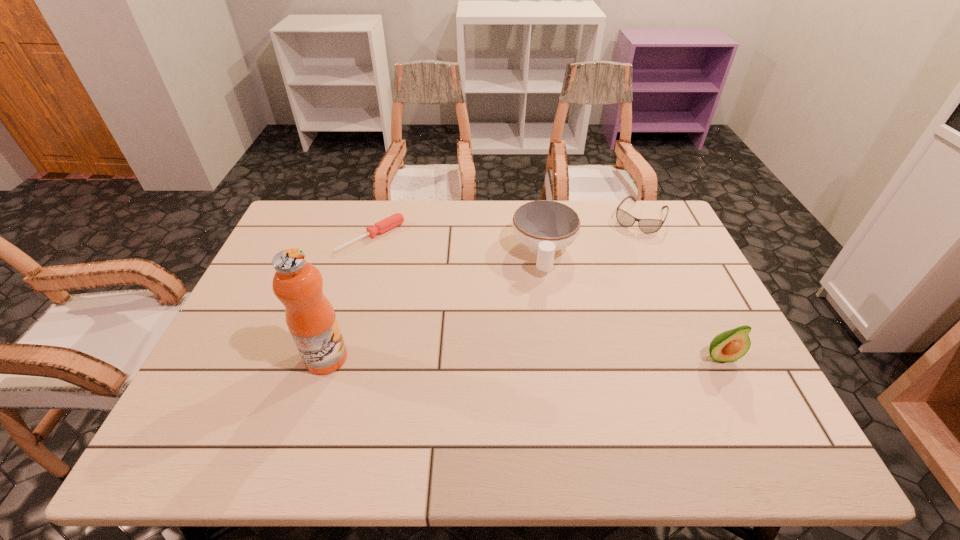
I want to click on free space that satisfies the following two spatial constraints: 1. on the back side of the third tallest object; 2. on the right side of the tallest object, so click(x=359, y=252).

Where is `free space in the image that satisfies the following two spatial constraints: 1. on the back side of the chinaware; 2. on the right side of the sunglasses`? The width and height of the screenshot is (960, 540). free space in the image that satisfies the following two spatial constraints: 1. on the back side of the chinaware; 2. on the right side of the sunglasses is located at coordinates (539, 218).